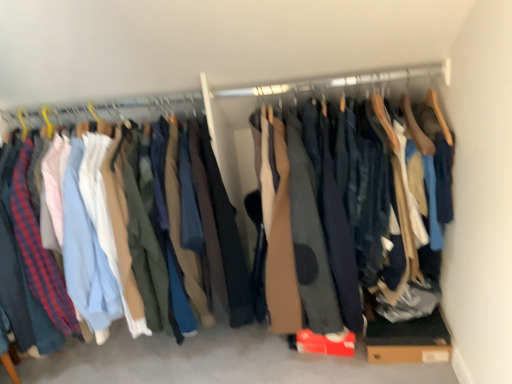
Image resolution: width=512 pixels, height=384 pixels. In order to click on dark gray fabric pants at center in this screenshot , I will do `click(312, 215)`.

What is the approximate height of brown cardboard box at lower right?

The height of brown cardboard box at lower right is 5.30 inches.

You are a GUI agent. You are given a task and a screenshot of the screen. Output one action in this format:
    pyautogui.click(x=<x>, y=<y>)
    Task: Click on the dark blue cotton pants at left
    This screenshot has width=512, height=384.
    Given the screenshot: What is the action you would take?
    pyautogui.click(x=306, y=223)

How much distance is there between dark gray fabric pants at center and dark blue cotton pants at left?

dark gray fabric pants at center and dark blue cotton pants at left are 3.32 inches apart from each other.

Is dark blue cotton pants at left completely or partially inside dark gray fabric pants at center?

That's incorrect, dark blue cotton pants at left is not inside dark gray fabric pants at center.

From a real-world perspective, who is located lower, dark gray fabric pants at center or dark blue cotton pants at left?

dark blue cotton pants at left.

Does dark gray fabric pants at center have a lesser width compared to dark blue cotton pants at left?

No.

Considering the sizes of objects dark gray fabric pants at center and wooden hanger at upper center in the image provided, who is taller, dark gray fabric pants at center or wooden hanger at upper center?

dark gray fabric pants at center is taller.

What's the angular difference between dark gray fabric pants at center and wooden hanger at upper center's facing directions?

They differ by 2.67 degrees in their facing directions.

From the image's perspective, is dark gray fabric pants at center beneath wooden hanger at upper center?

Correct, dark gray fabric pants at center appears lower than wooden hanger at upper center in the image.

Could you tell me if dark gray fabric pants at center is turned towards wooden hanger at upper center?

No, dark gray fabric pants at center is not aimed at wooden hanger at upper center.

Considering the relative positions of wooden hanger at upper center and brown cardboard box at lower right in the image provided, is wooden hanger at upper center behind brown cardboard box at lower right?

No, it is in front of brown cardboard box at lower right.

Between wooden hanger at upper center and brown cardboard box at lower right, which one appears on the left side from the viewer's perspective?

wooden hanger at upper center.

From a real-world perspective, which object rests below the other?

In real-world perspective, brown cardboard box at lower right is lower.

Does point (360, 99) come in front of point (443, 324)?

No, (360, 99) is further to viewer.

Is wooden hanger at upper center further to the viewer compared to dark blue cotton pants at left?

A: That is True.

Does wooden hanger at upper center have a greater width compared to dark blue cotton pants at left?

No.

Is point (262, 86) positioned after point (289, 153)?

Yes, point (262, 86) is farther from viewer.

What's the angular difference between wooden hanger at upper center and dark blue cotton pants at left's facing directions?

They differ by 2.67 degrees in their facing directions.

Is brown cardboard box at lower right closer to the viewer compared to wooden hanger at upper center?

No.

From the image's perspective, which object appears higher, brown cardboard box at lower right or wooden hanger at upper center?

wooden hanger at upper center appears higher in the image.

Does brown cardboard box at lower right have a greater height compared to wooden hanger at upper center?

Indeed, brown cardboard box at lower right has a greater height compared to wooden hanger at upper center.

Which point is more distant from viewer, (425, 334) or (413, 77)?

Point (413, 77)

Choose the correct answer: Is wooden hanger at upper center inside dark gray fabric pants at center or outside it?

wooden hanger at upper center is inside dark gray fabric pants at center.

This screenshot has width=512, height=384. Find the location of `clothing in front of the wooden hanger at upper center`. clothing in front of the wooden hanger at upper center is located at coordinates (312, 215).

Does point (258, 101) come behind point (255, 153)?

That is False.

Based on the photo, considering their positions, is brown cardboard box at lower right located in front of or behind dark gray fabric pants at center?

In the image, brown cardboard box at lower right appears behind dark gray fabric pants at center.

In the scene shown: Would you consider brown cardboard box at lower right to be distant from dark gray fabric pants at center?

No.

Can you confirm if brown cardboard box at lower right is bigger than dark gray fabric pants at center?

Actually, brown cardboard box at lower right might be smaller than dark gray fabric pants at center.

The height and width of the screenshot is (384, 512). I want to click on trousers behind the dark gray fabric pants at center, so click(x=306, y=223).

Where is `clothing on the right of the wooden hanger at upper center`? clothing on the right of the wooden hanger at upper center is located at coordinates (312, 215).

Based on their spatial positions, is dark blue cotton pants at left or wooden hanger at upper center further from dark gray fabric pants at center?

The object further to dark gray fabric pants at center is wooden hanger at upper center.

Looking at the image, which one is located further to brown cardboard box at lower right, dark gray fabric pants at center or dark blue cotton pants at left?

Among the two, dark blue cotton pants at left is located further to brown cardboard box at lower right.

Estimate the real-world distances between objects in this image. Which object is further from dark blue cotton pants at left, wooden hanger at upper center or brown cardboard box at lower right?

The object further to dark blue cotton pants at left is brown cardboard box at lower right.

Estimate the real-world distances between objects in this image. Which object is further from dark blue cotton pants at left, dark gray fabric pants at center or brown cardboard box at lower right?

Based on the image, brown cardboard box at lower right appears to be further to dark blue cotton pants at left.

From the image, which object appears to be farther from dark gray fabric pants at center, wooden hanger at upper center or dark blue cotton pants at left?

The object further to dark gray fabric pants at center is wooden hanger at upper center.

When comparing their distances from wooden hanger at upper center, does brown cardboard box at lower right or dark gray fabric pants at center seem further?

The object further to wooden hanger at upper center is brown cardboard box at lower right.

When comparing their distances from dark gray fabric pants at center, does wooden hanger at upper center or brown cardboard box at lower right seem further?

wooden hanger at upper center is positioned further to the anchor dark gray fabric pants at center.

Looking at the image, which one is located further to dark blue cotton pants at left, wooden hanger at upper center or dark gray fabric pants at center?

wooden hanger at upper center is positioned further to the anchor dark blue cotton pants at left.

The image size is (512, 384). I want to click on clothing between wooden hanger at upper center and brown cardboard box at lower right in the up-down direction, so click(x=312, y=215).

Identify the location of hanger situated between dark blue cotton pants at left and brown cardboard box at lower right from left to right. (351, 86).

I want to click on clothing between dark blue cotton pants at left and brown cardboard box at lower right from left to right, so click(312, 215).

Where is `hanger between dark blue cotton pants at left and dark gray fabric pants at center`? Image resolution: width=512 pixels, height=384 pixels. hanger between dark blue cotton pants at left and dark gray fabric pants at center is located at coordinates (351, 86).